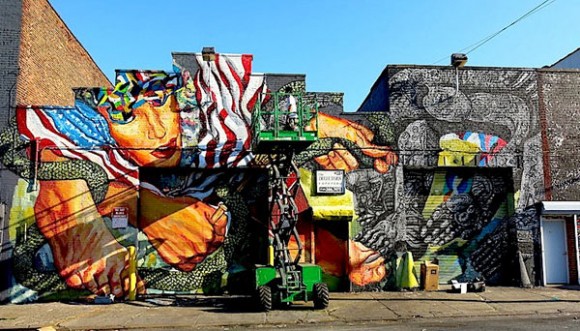
Where is `mural`? mural is located at coordinates (39, 242), (108, 248), (177, 251), (78, 184), (119, 175), (148, 120), (203, 120), (240, 92).